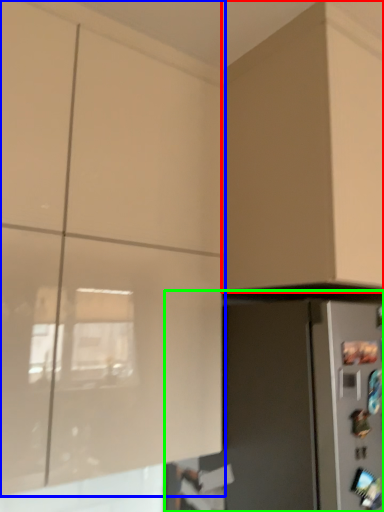
Question: Which object is positioned closest to cabinetry (highlighted by a red box)? Select from cabinetry (highlighted by a blue box) and appliance (highlighted by a green box).

Choices:
 (A) cabinetry
 (B) appliance

Answer: (B)